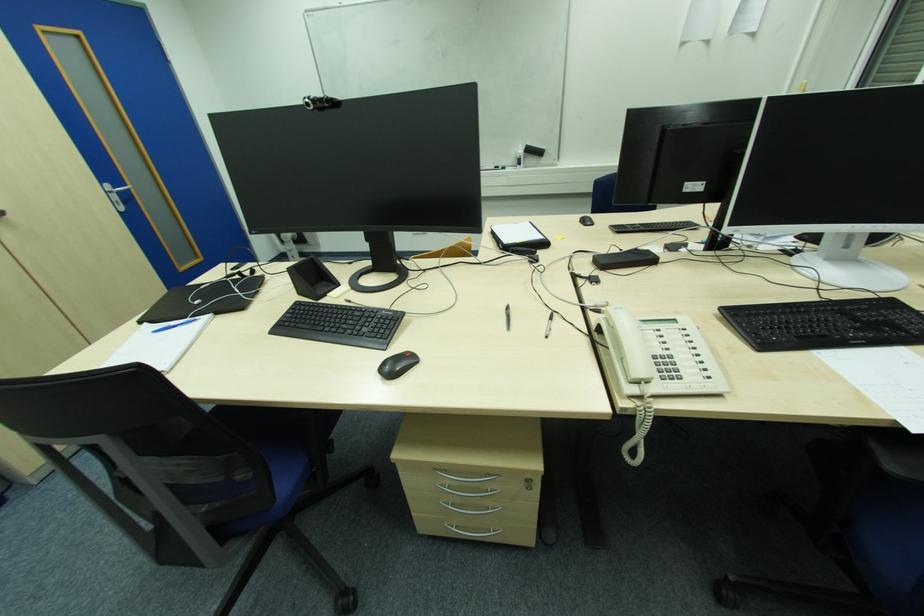
Identify the location of blue pen. (174, 325).